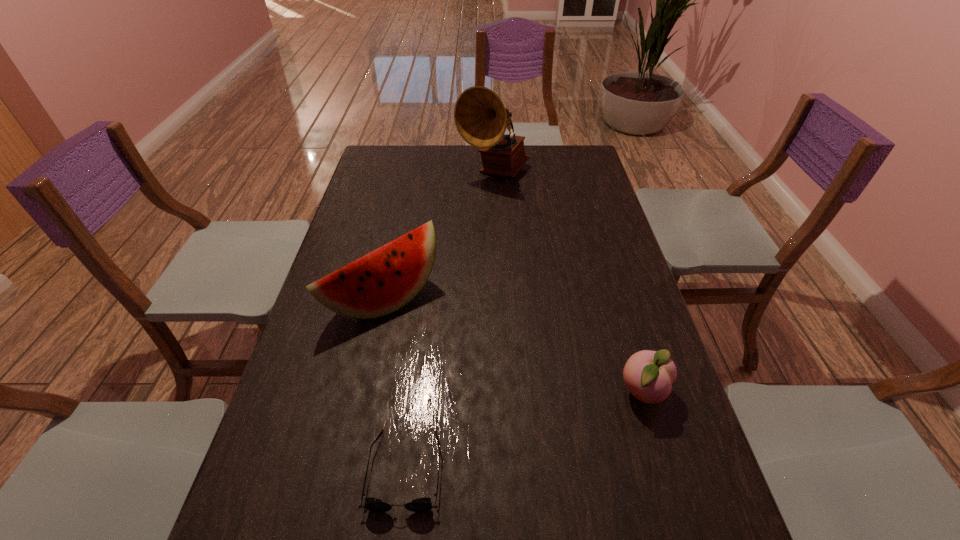
This screenshot has height=540, width=960. I want to click on vacant space on the desktop that is between the sunglasses and the peach and is positioned on the outer rind of the third shortest object, so pos(528,430).

At what (x,y) coordinates should I click in order to perform the action: click on vacant space on the desktop that is between the shortest object and the rightmost object and is positioned on the horn of the farthest object. Please return your answer as a coordinate pair (x, y). This screenshot has height=540, width=960. Looking at the image, I should click on (512, 435).